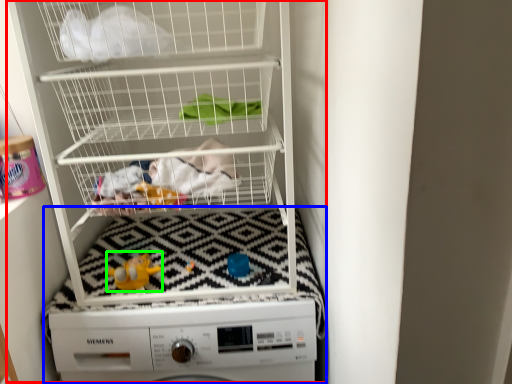
Question: Estimate the real-world distances between objects in this image. Which object is farther from bunk bed (highlighted by a red box), machine (highlighted by a blue box) or toy (highlighted by a green box)?

Choices:
 (A) machine
 (B) toy

Answer: (B)